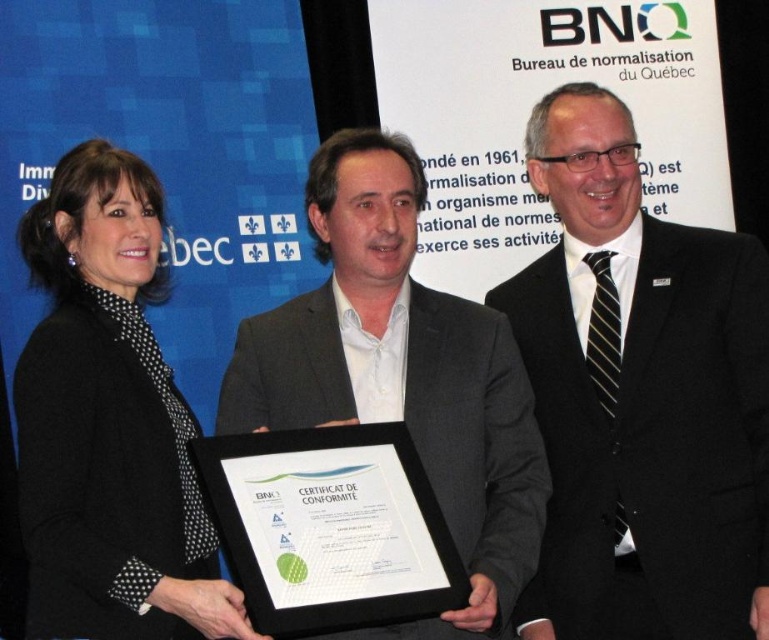
Based on the provided scene description, what object is located at the coordinates point (641, 397)?

The point (641, 397) corresponds to the black suit at center.

You are attending a formal event and need to determine the appropriate attire for a presentation. You notice two individuals wearing the black dotted blazer at left and the matte gray suit at center. Which one has a longer jacket length?

The matte gray suit at center has a longer jacket length than the black dotted blazer at left.